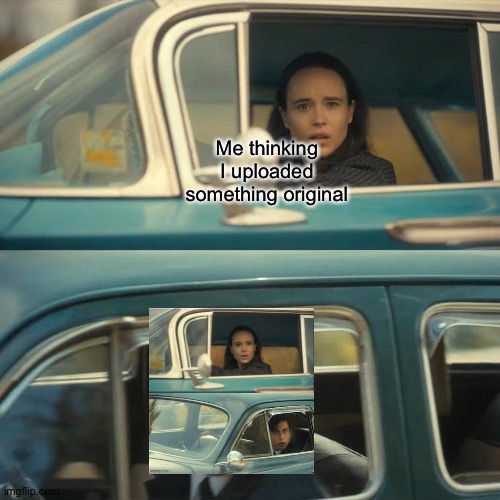
I want to click on door handle, so click(x=445, y=233), click(x=297, y=389), click(x=311, y=470).